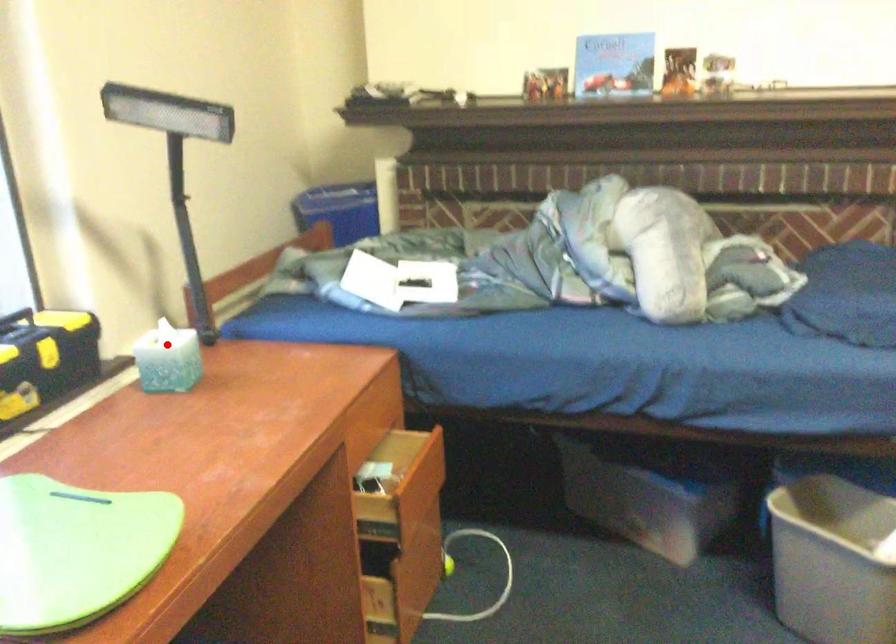
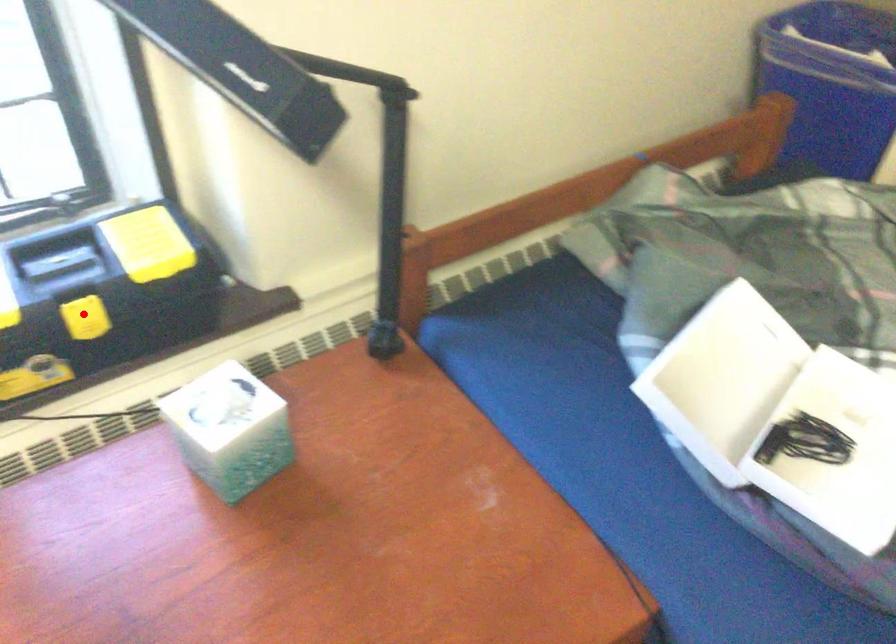
I am providing you with two images of the same scene from different viewpoints. A red point is marked on the first image and another point is marked on the second image. Is the marked point in image1 the same physical position as the marked point in image2?

No